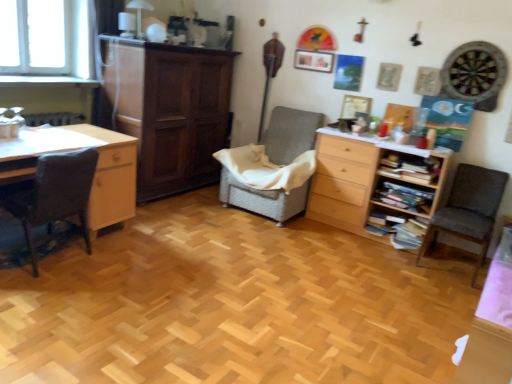
I want to click on vacant area situated to the left side of woven fabric chair at center, arranged as the 2th chair when viewed from the left, so click(x=190, y=207).